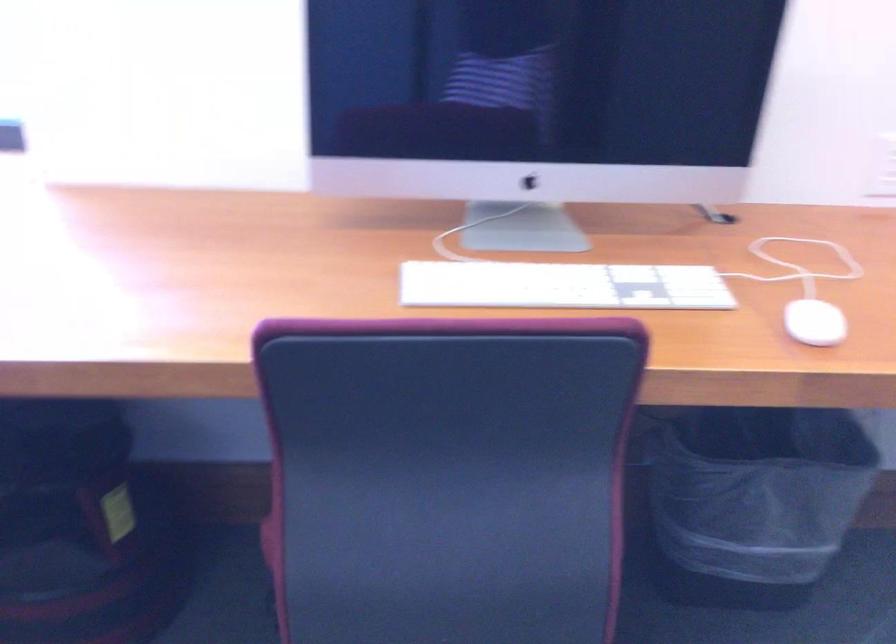
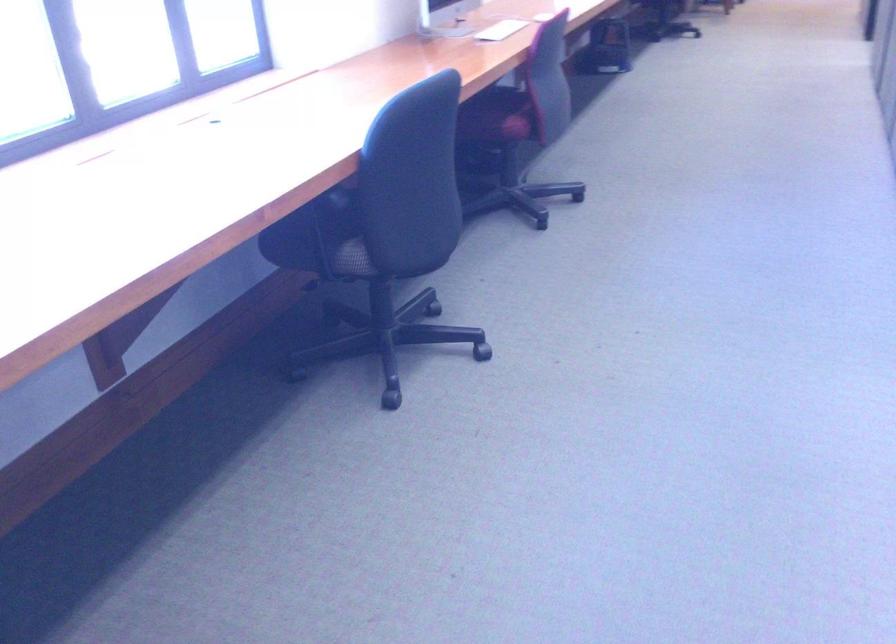
Question: I am providing you with two images of the same scene from different viewpoints. Which of the following objects are not visible in image2?

Choices:
 (A) chair sitting surface
 (B) black trash can
 (C) green bottle crate
 (D) white paper

Answer: (B)